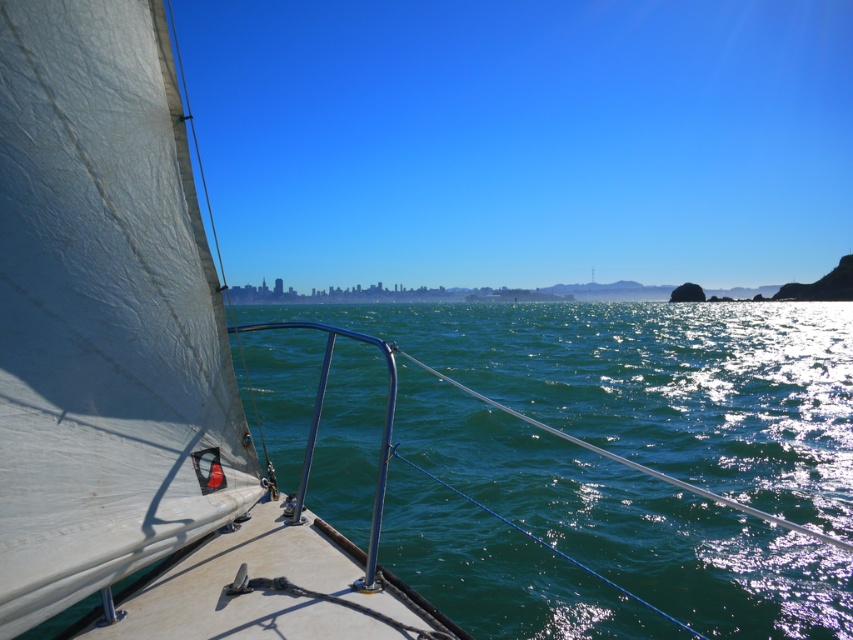
You are standing on the deck of the sailboat and want to take a photo of both the white sail at left and the green water at center. Which object should you focus on first to ensure both are in sharp focus?

You should focus on the white sail at left first because it is closer to the viewer than the green water at center, so adjusting focus starting from the closer object ensures both will be in focus.

You are a sailor standing on the deck of the sailboat. You need to move from the green water at center to the white matte sail at center. Can you walk directly between them without any obstacles? Please explain your reasoning.

The green water at center and white matte sail at center are 14.42 meters apart, so there is enough space to walk directly between them without any obstacles.